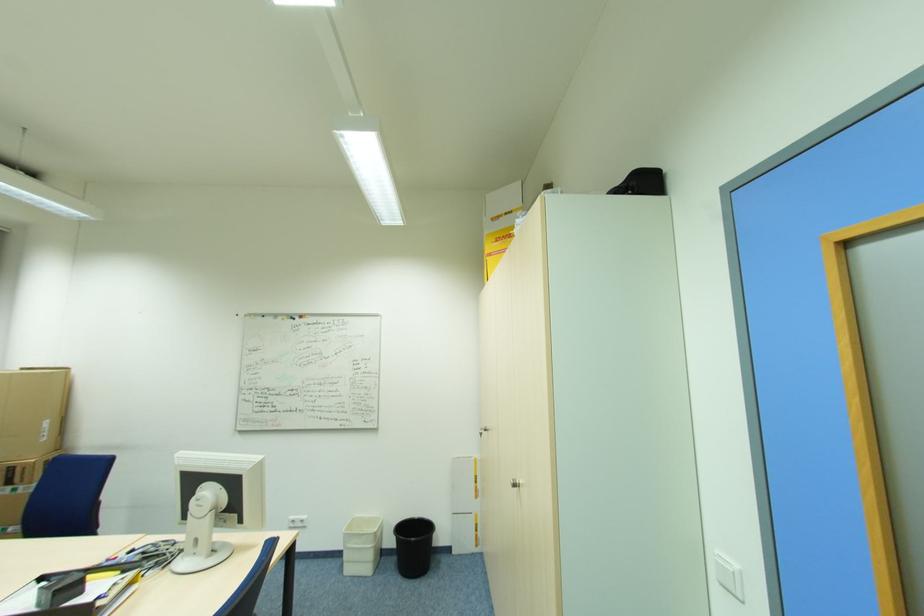
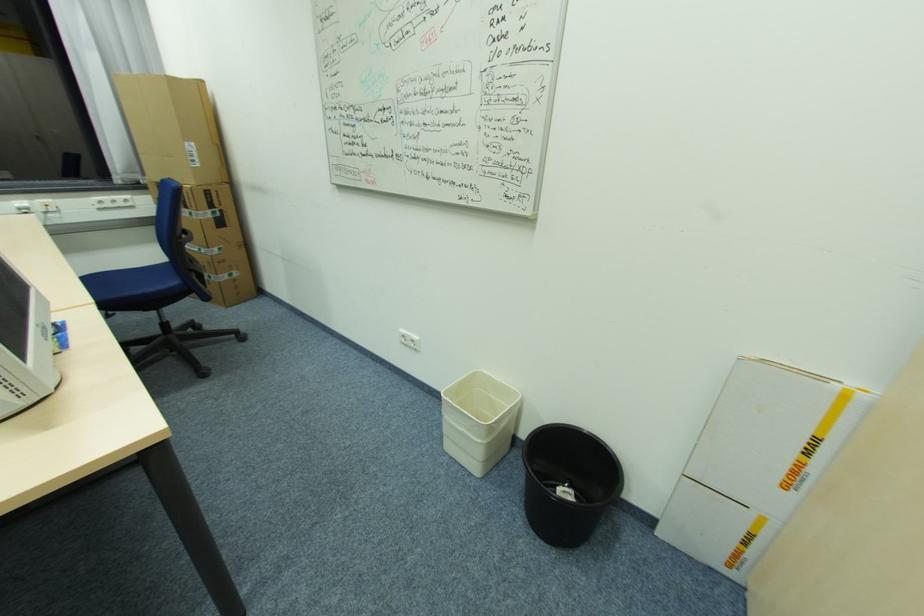
The point at (408, 581) is marked in the first image. Where is the corresponding point in the second image?

(533, 532)